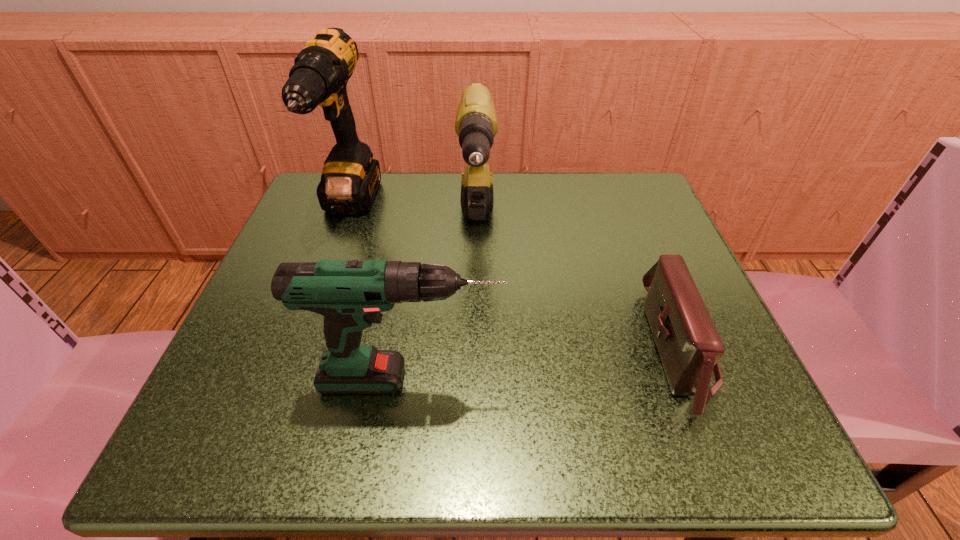
At what (x,y) coordinates should I click in order to perform the action: click on the tallest object. Please return your answer as a coordinate pair (x, y). The image size is (960, 540). Looking at the image, I should click on (350, 179).

The height and width of the screenshot is (540, 960). In order to click on the nearest drill in this screenshot , I will do pyautogui.click(x=351, y=294).

Identify the location of the rightmost object. (689, 346).

The height and width of the screenshot is (540, 960). I want to click on shoulder bag, so [689, 346].

Image resolution: width=960 pixels, height=540 pixels. In order to click on vacant area located at the tip of the tallest object in this screenshot , I will do `click(292, 365)`.

Identify the location of free space located 0.240m on the handle side of the nearest drill. The image size is (960, 540). (670, 379).

Image resolution: width=960 pixels, height=540 pixels. Identify the location of blank space located on the front flap of the rightmost object. (531, 349).

The height and width of the screenshot is (540, 960). I want to click on vacant space located 0.090m on the front flap of the rightmost object, so click(x=590, y=349).

The width and height of the screenshot is (960, 540). Find the location of `vacant region located on the front flap of the rightmost object`. vacant region located on the front flap of the rightmost object is located at coordinates (419, 349).

Locate an element on the screen. Image resolution: width=960 pixels, height=540 pixels. object that is at the near edge is located at coordinates (689, 346).